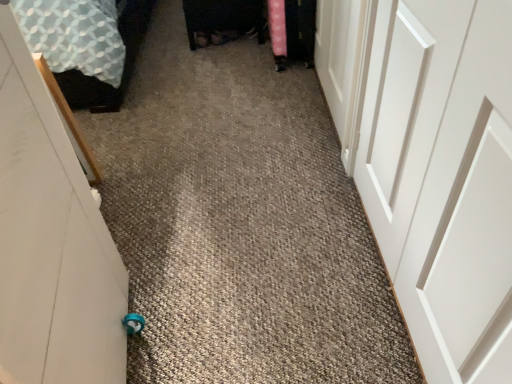
Image resolution: width=512 pixels, height=384 pixels. Find the location of `vacant space situated on the left part of white matte door at upper right, positioned as the 2th door in right-to-left order`. vacant space situated on the left part of white matte door at upper right, positioned as the 2th door in right-to-left order is located at coordinates (222, 107).